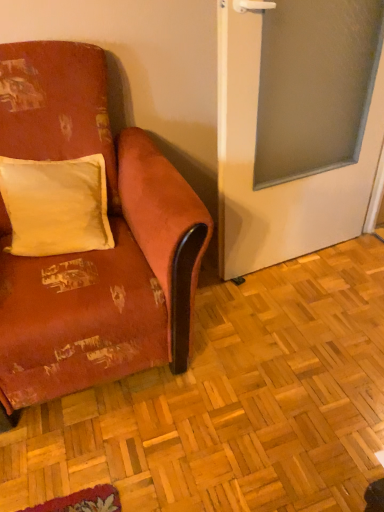
Question: Considering the relative sizes of velvet-like orange couch at left and frosted glass screen door at right in the image provided, is velvet-like orange couch at left thinner than frosted glass screen door at right?

Choices:
 (A) no
 (B) yes

Answer: (A)

Question: Is velvet-like orange couch at left positioned with its back to frosted glass screen door at right?

Choices:
 (A) yes
 (B) no

Answer: (B)

Question: From a real-world perspective, is velvet-like orange couch at left beneath frosted glass screen door at right?

Choices:
 (A) no
 (B) yes

Answer: (B)

Question: From the image's perspective, is velvet-like orange couch at left on frosted glass screen door at right?

Choices:
 (A) yes
 (B) no

Answer: (B)

Question: Is velvet-like orange couch at left shorter than frosted glass screen door at right?

Choices:
 (A) yes
 (B) no

Answer: (A)

Question: Can you confirm if velvet-like orange couch at left is bigger than frosted glass screen door at right?

Choices:
 (A) no
 (B) yes

Answer: (B)

Question: Is white soft cushion at upper left facing towards velvet-like orange couch at left?

Choices:
 (A) no
 (B) yes

Answer: (B)

Question: Is white soft cushion at upper left shorter than velvet-like orange couch at left?

Choices:
 (A) no
 (B) yes

Answer: (B)

Question: From the image's perspective, would you say white soft cushion at upper left is shown under velvet-like orange couch at left?

Choices:
 (A) yes
 (B) no

Answer: (B)

Question: Is the position of white soft cushion at upper left more distant than that of velvet-like orange couch at left?

Choices:
 (A) yes
 (B) no

Answer: (A)

Question: Is white soft cushion at upper left to the left of velvet-like orange couch at left from the viewer's perspective?

Choices:
 (A) no
 (B) yes

Answer: (B)

Question: Are white soft cushion at upper left and velvet-like orange couch at left beside each other?

Choices:
 (A) yes
 (B) no

Answer: (B)

Question: From the image's perspective, is frosted glass screen door at right on top of velvet-like orange couch at left?

Choices:
 (A) yes
 (B) no

Answer: (A)